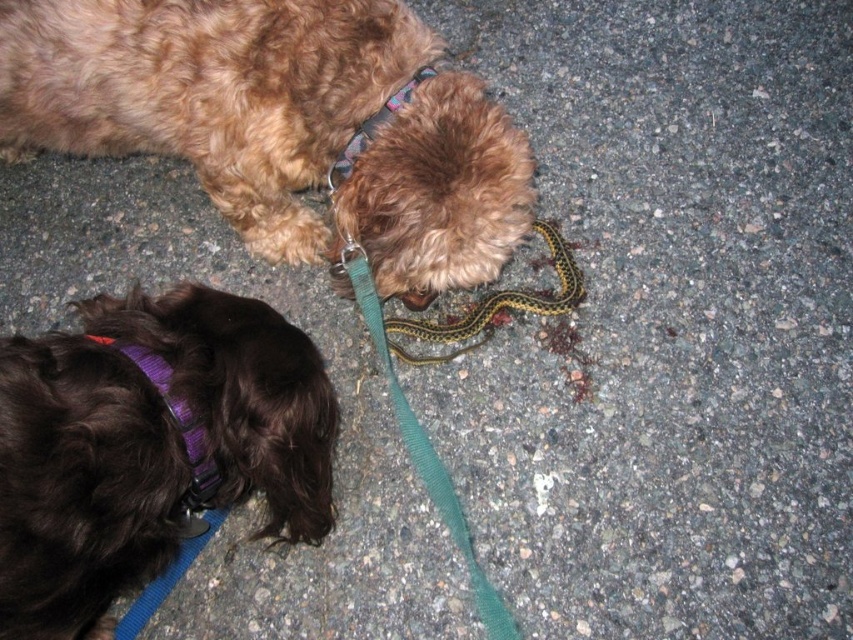
You are a dog owner trying to locate your dog wearing the purple fabric neckband at lower left. Based on the coordinates provided, where should you look relative to the snake?

The purple fabric neckband at lower left is located at point (x=177, y=424), which places it near the lower left area of the image. Since the snake is on the ground where both dogs are sniffing, the purple fabric neckband at lower left is likely positioned to the left of the snake.

You are a dog owner holding a 1.2 meter long leash. You see the green nylon leash at center on the ground. Can you reach it without moving your feet?

The distance between you and the green nylon leash at center is 1.35 meters. Since your leash is only 1.2 meters long, you cannot reach the green nylon leash at center without moving your feet.